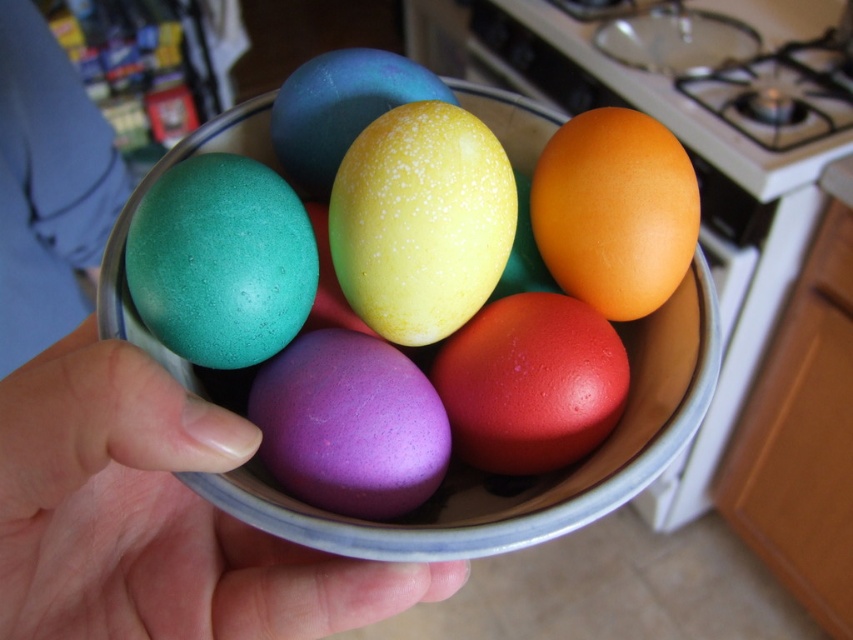
Question: Considering the relative positions of matte blue shirt at lower left and matte yellow egg at center in the image provided, where is matte blue shirt at lower left located with respect to matte yellow egg at center?

Choices:
 (A) below
 (B) above

Answer: (B)

Question: Can you confirm if matte ceramic bowl at center is smaller than matte teal egg at center-left?

Choices:
 (A) yes
 (B) no

Answer: (B)

Question: Is matte ceramic bowl at center positioned before matte teal egg at center-left?

Choices:
 (A) no
 (B) yes

Answer: (B)

Question: Which point appears closest to the camera in this image?

Choices:
 (A) (244, 314)
 (B) (498, 545)
 (C) (361, 244)
 (D) (403, 68)

Answer: (B)

Question: Which point is closer to the camera taking this photo?

Choices:
 (A) (328, 104)
 (B) (55, 376)
 (C) (22, 124)
 (D) (640, 234)

Answer: (B)

Question: Which object is the farthest from the nail polish at lower center?

Choices:
 (A) matte red egg at center
 (B) matte yellow egg at center

Answer: (B)